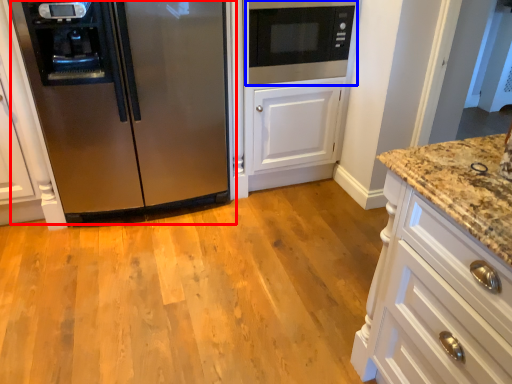
Question: Which of the following is the closest to the observer, refrigerator (highlighted by a red box) or microwave oven (highlighted by a blue box)?

Choices:
 (A) refrigerator
 (B) microwave oven

Answer: (A)